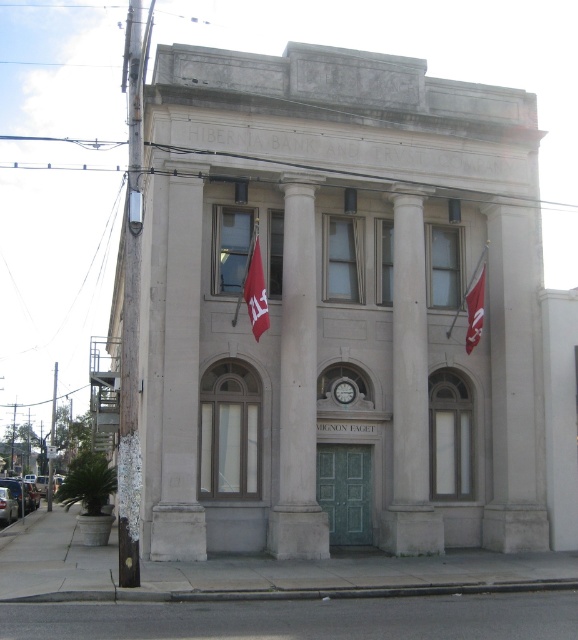
Locate an element on the screen. The image size is (578, 640). red fabric flag at center is located at coordinates 255,291.

Is white stone column at center positioned in front of red fabric flag at right?

Yes.

Who is shorter, white stone column at center or red fabric flag at right?

Standing shorter between the two is red fabric flag at right.

Is point (279, 452) positioned after point (477, 314)?

No, it is in front of (477, 314).

The width and height of the screenshot is (578, 640). In order to click on white stone column at center in this screenshot , I will do `click(298, 388)`.

Is white smooth pillar at center positioned behind red fabric flag at center?

That is False.

Does white smooth pillar at center have a greater width compared to red fabric flag at center?

Yes.

Which is behind, point (190, 324) or point (258, 292)?

Positioned behind is point (190, 324).

The height and width of the screenshot is (640, 578). Identify the location of white smooth pillar at center. (180, 381).